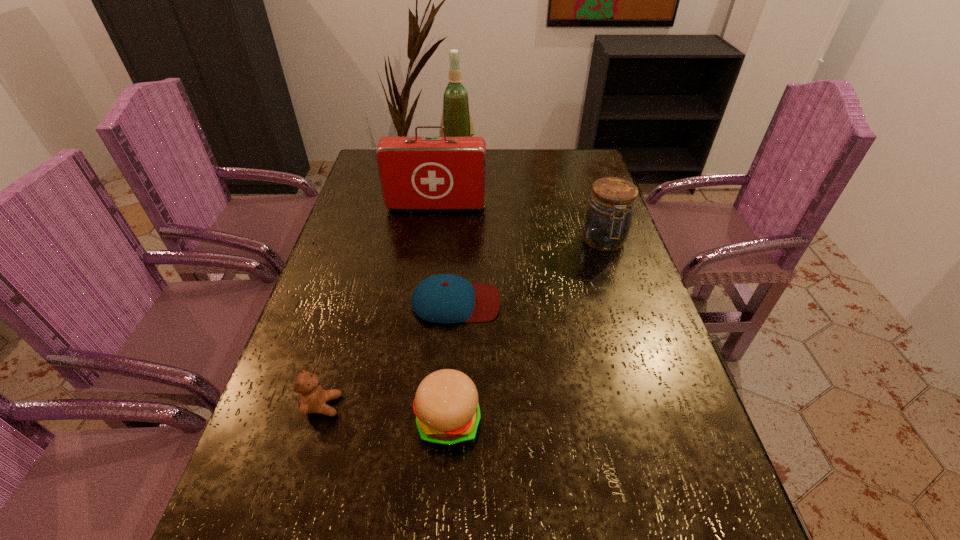
This screenshot has height=540, width=960. In order to click on free spot located 0.310m on the front-facing side of the farthest object in this screenshot , I will do (x=453, y=218).

This screenshot has height=540, width=960. Identify the location of blank area located 0.180m on the side of the second farthest object with the first aid cross symbol. (430, 251).

Locate an element on the screen. The height and width of the screenshot is (540, 960). free space located on the lid of the third farthest object is located at coordinates (648, 375).

The image size is (960, 540). Find the location of `vacant area situated 0.320m on the back of the hamburger`. vacant area situated 0.320m on the back of the hamburger is located at coordinates (456, 284).

Image resolution: width=960 pixels, height=540 pixels. What are the coordinates of `vacant space located on the face of the teddy bear` in the screenshot? It's located at (451, 406).

I want to click on free spot located with the bill of the shortest object facing forward, so click(x=598, y=302).

Where is `object present at the far edge`? object present at the far edge is located at coordinates (456, 118).

This screenshot has width=960, height=540. Find the location of `the first-aid kit located in the left edge section of the desktop`. the first-aid kit located in the left edge section of the desktop is located at coordinates (416, 173).

At what (x,y) coordinates should I click in order to perform the action: click on teddy bear present at the left edge. Please return your answer as a coordinate pair (x, y). The width and height of the screenshot is (960, 540). Looking at the image, I should click on (312, 398).

In order to click on object at the right edge in this screenshot , I will do `click(607, 222)`.